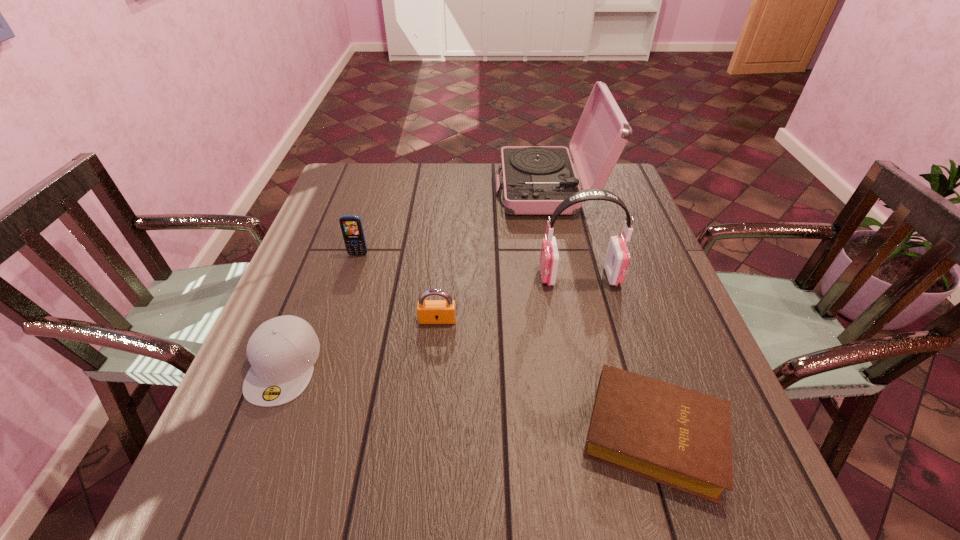
Identify the location of object that is at the near edge. The image size is (960, 540). (681, 438).

The width and height of the screenshot is (960, 540). I want to click on cellular telephone positioned at the left edge, so click(351, 226).

The height and width of the screenshot is (540, 960). What are the coordinates of `cap that is at the left edge` in the screenshot? It's located at (282, 351).

This screenshot has height=540, width=960. Identify the location of record player located in the right edge section of the desktop. (536, 179).

The width and height of the screenshot is (960, 540). I want to click on earphone located in the right edge section of the desktop, so click(x=617, y=258).

Find the location of a particular element. Bible located at the right edge is located at coordinates (681, 438).

Where is `object situated at the far right corner`? object situated at the far right corner is located at coordinates (536, 179).

Locate an element on the screen. This screenshot has width=960, height=540. object that is at the near right corner is located at coordinates (681, 438).

You are a GUI agent. You are given a task and a screenshot of the screen. Output one action in this format:
    pyautogui.click(x=<x>, y=<y>)
    Task: Click on the free space at the far edge
    Image resolution: width=960 pixels, height=540 pixels.
    Given the screenshot: What is the action you would take?
    pyautogui.click(x=418, y=178)

Find the location of `vacant space at the near edge of the desktop`. vacant space at the near edge of the desktop is located at coordinates (553, 522).